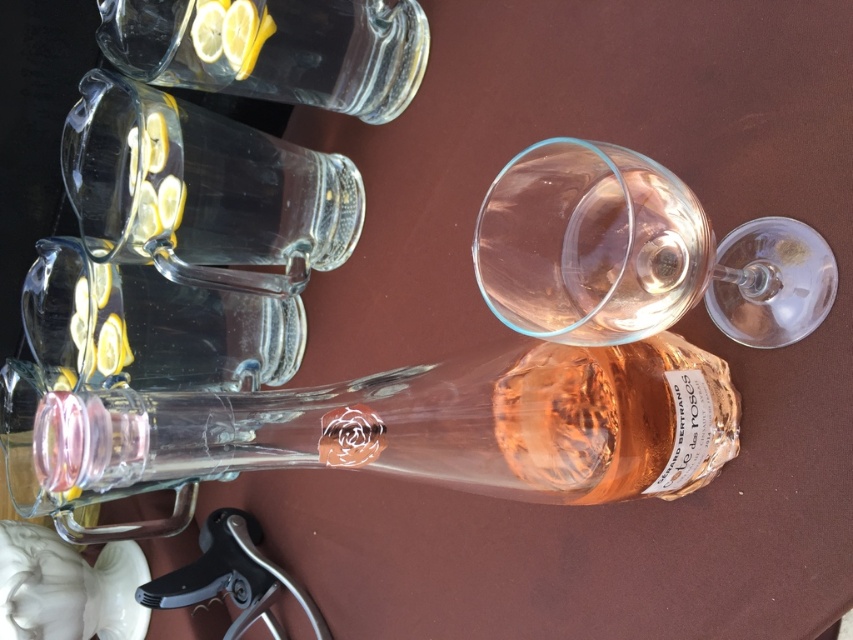
You are at a dinner party and need to pour water into the transparent glass wine glass at center. The clear glass carafe at upper left contains the water. Can you reach the carafe without moving the glass?

The transparent glass wine glass at center is to the right of the clear glass carafe at upper left, so you can reach the carafe without moving the glass as they are positioned side by side.

You are standing at the edge of the table looking towards the center. There are two points on the table surface labeled as point (676, 436) and point (186, 22). Which point is closer to you?

Point (186, 22) is closer to you because it is behind point (676, 436), which is in front.